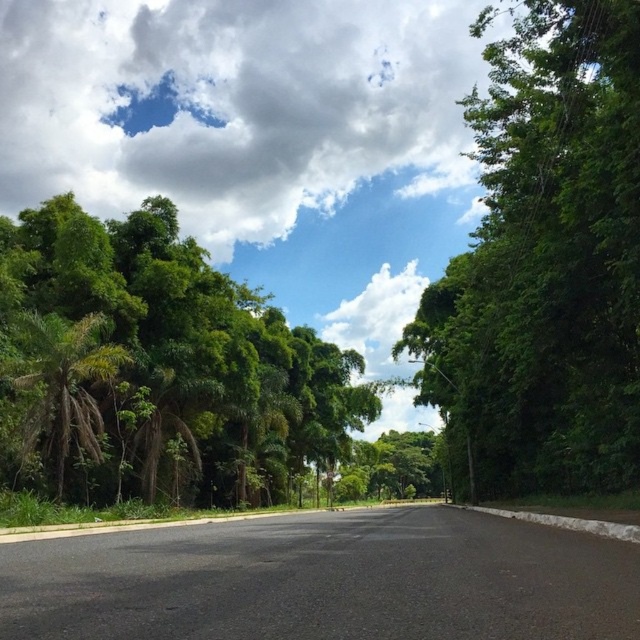
Which is behind, point (509, 307) or point (224, 496)?

Point (224, 496)

Where is `green leafy tree at center`? The height and width of the screenshot is (640, 640). green leafy tree at center is located at coordinates (545, 264).

Find the location of a particular element. The height and width of the screenshot is (640, 640). green leafy tree at center is located at coordinates (545, 264).

Can you confirm if white fluffy cloud at upper center is shorter than green leafy palm tree at left?

Incorrect, white fluffy cloud at upper center's height does not fall short of green leafy palm tree at left's.

Is point (448, 220) in front of point (65, 348)?

No, (448, 220) is further to viewer.

Find the location of `white fluffy cloud at upper center`. white fluffy cloud at upper center is located at coordinates pos(234,108).

Who is more forward, (428, 115) or (96, 296)?

Point (96, 296)

Can you confirm if white fluffy cloud at upper center is positioned below green leafy tree at left?

Actually, white fluffy cloud at upper center is above green leafy tree at left.

Locate an element on the screen. white fluffy cloud at upper center is located at coordinates (234, 108).